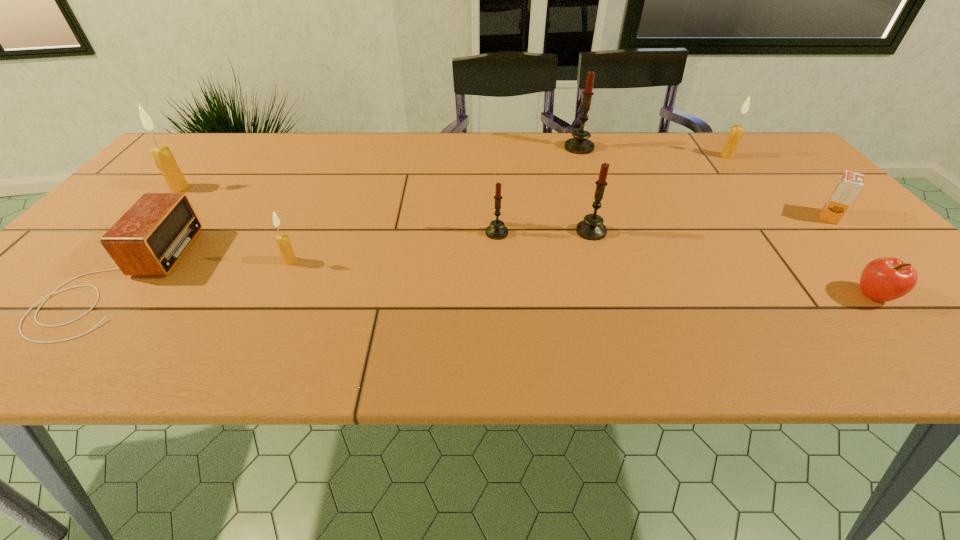
You are a GUI agent. You are given a task and a screenshot of the screen. Output one action in this format:
    pyautogui.click(x=<x>, y=<y>)
    Task: Click on the farthest red candle
    The height and width of the screenshot is (540, 960).
    Given the screenshot: What is the action you would take?
    pyautogui.click(x=580, y=144)

Locate an element on the screen. This screenshot has height=540, width=960. the fourth nearest candle is located at coordinates [163, 157].

You are a GUI agent. You are given a task and a screenshot of the screen. Output one action in this format:
    pyautogui.click(x=<x>, y=<y>)
    Task: Click on the biggest cream candle
    Image resolution: width=960 pixels, height=540 pixels.
    Given the screenshot: What is the action you would take?
    pyautogui.click(x=163, y=157)

The height and width of the screenshot is (540, 960). I want to click on the second biggest red candle, so click(591, 228).

Find the location of a particular element. the rightmost cream candle is located at coordinates (736, 132).

Where is `the farthest cream candle`? the farthest cream candle is located at coordinates (736, 132).

The image size is (960, 540). What are the coordinates of `the leftmost red candle` in the screenshot? It's located at (496, 230).

Where is `the smallest red candle`? the smallest red candle is located at coordinates (496, 230).

Identify the location of the third object from left to right. click(284, 244).

At what (x,y) coordinates should I click in order to perform the action: click on the smallest cream candle. Please return your answer as a coordinate pair (x, y). The width and height of the screenshot is (960, 540). Looking at the image, I should click on (284, 244).